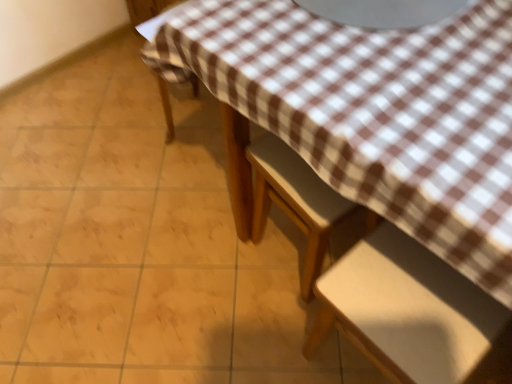
In order to click on free spot above white matte chair at lower right, marked as the 3th chair in a top-to-bottom arrangement (from a real-world perspective) in this screenshot , I will do `click(413, 307)`.